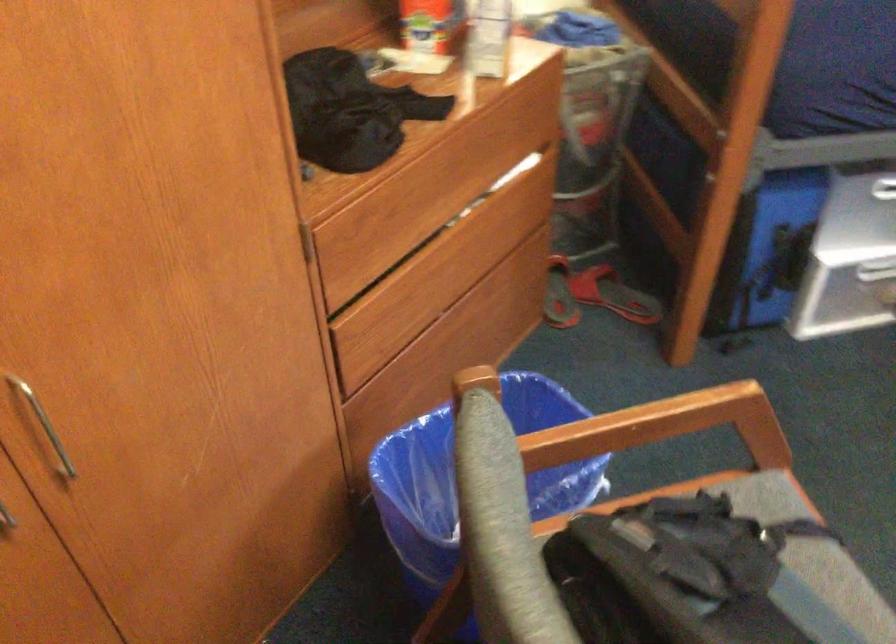
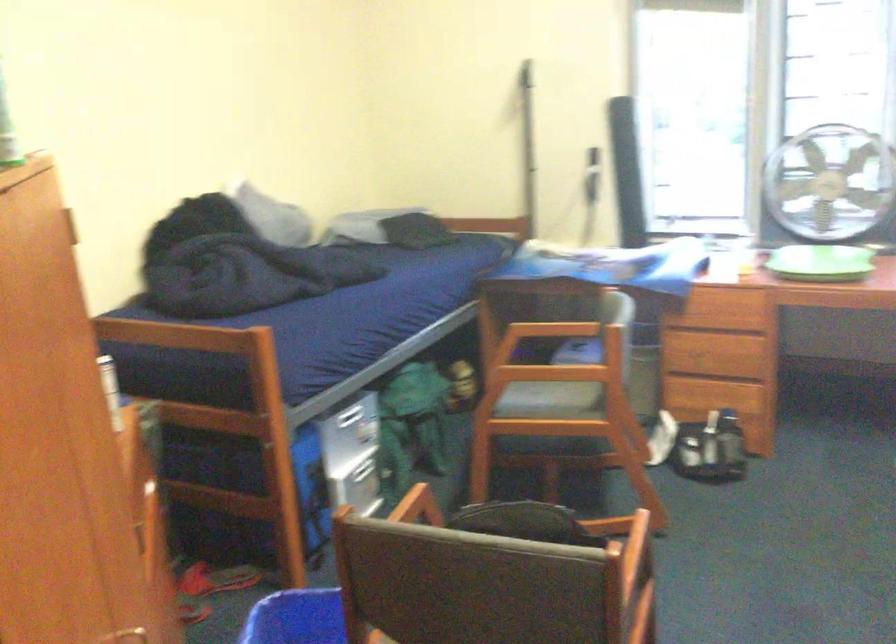
Question: I am providing you with two images of the same scene from different viewpoints. Please identify which objects are invisible in image2.

Choices:
 (A) wooden drawer front
 (B) gray chair seat
 (C) green model airplane
 (D) silver drawer handle

Answer: (A)